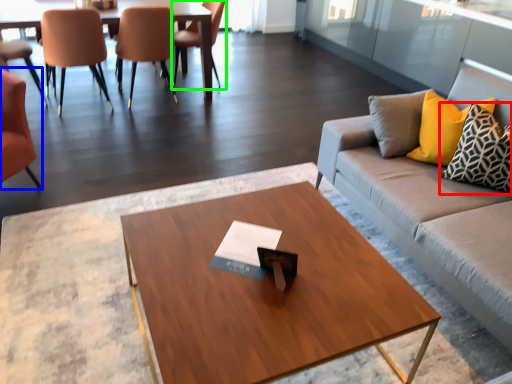
Question: Estimate the real-world distances between objects in this image. Which object is farther from pillow (highlighted by a red box), chair (highlighted by a blue box) or chair (highlighted by a green box)?

Choices:
 (A) chair
 (B) chair

Answer: (B)